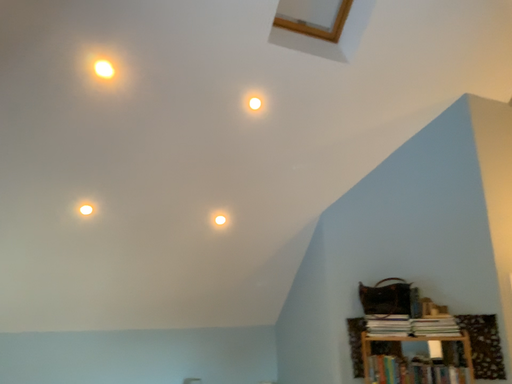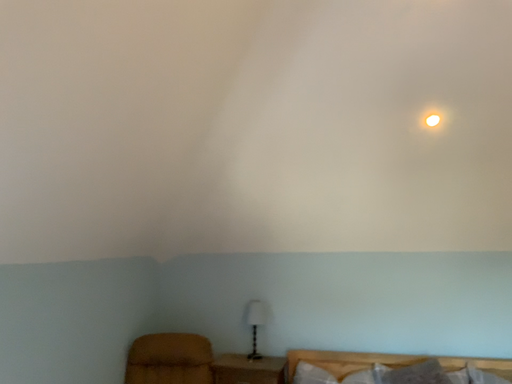
Question: How did the camera likely rotate when shooting the video?

Choices:
 (A) rotated left
 (B) rotated right

Answer: (A)